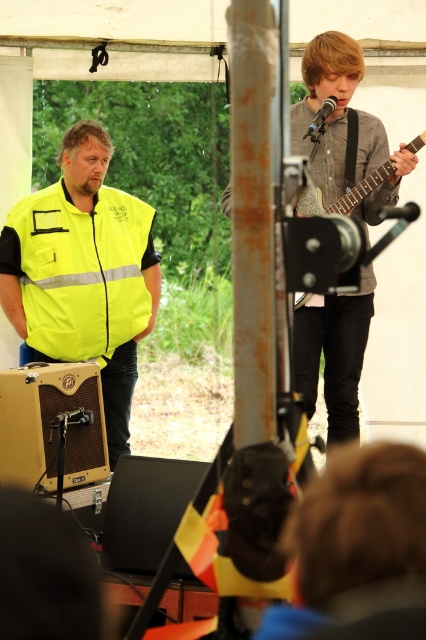
You are an event photographer trying to capture a photo of both the gray textured shirt at center and the wooden acoustic guitar at upper right. Based on their positions, which object is closer to the right edge of the frame?

The wooden acoustic guitar at upper right is closer to the right edge of the frame because the gray textured shirt at center is positioned to its left.

You are a photographer positioned at the back of the tent and want to take a photo that includes both the yellow reflective vest at left and the wooden acoustic guitar at upper right. Which object will appear closer to you in the photo?

The yellow reflective vest at left will appear closer to you in the photo because it is positioned further to the viewer than the wooden acoustic guitar at upper right.